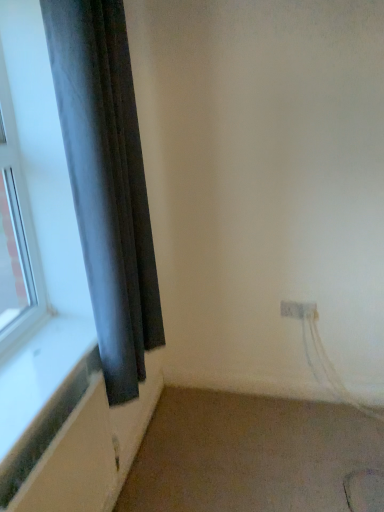
Describe the element at coordinates (107, 183) in the screenshot. This screenshot has height=512, width=384. I see `dark gray fabric curtain at left` at that location.

Identify the location of white plastic electric outlet at lower right. 299,310.

Could you tell me if beige carpet at lower right is facing white plastic electric outlet at lower right?

No, beige carpet at lower right is not turned towards white plastic electric outlet at lower right.

Is beige carpet at lower right taller than white plastic electric outlet at lower right?

In fact, beige carpet at lower right may be shorter than white plastic electric outlet at lower right.

Can you tell me how much beige carpet at lower right and white plastic electric outlet at lower right differ in facing direction?

90.7 degrees separate the facing orientations of beige carpet at lower right and white plastic electric outlet at lower right.

From a real-world perspective, between beige carpet at lower right and white plastic electric outlet at lower right, who is vertically higher?

white plastic electric outlet at lower right, from a real-world perspective.

In the image, is dark gray fabric curtain at left on the left side or the right side of beige carpet at lower right?

Clearly, dark gray fabric curtain at left is on the left of beige carpet at lower right in the image.

From a real-world perspective, is dark gray fabric curtain at left under beige carpet at lower right?

No, from a real-world perspective, dark gray fabric curtain at left is not beneath beige carpet at lower right.

Considering the positions of points (128, 374) and (183, 453), is point (128, 374) farther from camera compared to point (183, 453)?

No, it is not.

From the image's perspective, would you say dark gray fabric curtain at left is positioned over beige carpet at lower right?

Correct, dark gray fabric curtain at left appears higher than beige carpet at lower right in the image.

Is white plastic electric outlet at lower right aimed at beige carpet at lower right?

No, white plastic electric outlet at lower right is not facing towards beige carpet at lower right.

Considering the relative positions of white plastic electric outlet at lower right and beige carpet at lower right in the image provided, is white plastic electric outlet at lower right behind beige carpet at lower right?

Yes.

Is white plastic electric outlet at lower right not close to beige carpet at lower right?

Actually, white plastic electric outlet at lower right and beige carpet at lower right are a little close together.

Can you confirm if white plastic electric outlet at lower right is positioned to the right of beige carpet at lower right?

Correct, you'll find white plastic electric outlet at lower right to the right of beige carpet at lower right.

This screenshot has width=384, height=512. Find the location of `curtain to the left of white plastic electric outlet at lower right`. curtain to the left of white plastic electric outlet at lower right is located at coordinates (107, 183).

From the image's perspective, who appears lower, white plastic electric outlet at lower right or dark gray fabric curtain at left?

white plastic electric outlet at lower right, from the image's perspective.

How many degrees apart are the facing directions of white plastic electric outlet at lower right and dark gray fabric curtain at left?

There is a 90-degree angle between the facing directions of white plastic electric outlet at lower right and dark gray fabric curtain at left.

Which object is positioned more to the right, white plastic electric outlet at lower right or dark gray fabric curtain at left?

white plastic electric outlet at lower right is more to the right.

Could you tell me if dark gray fabric curtain at left is turned towards white plastic electric outlet at lower right?

No, dark gray fabric curtain at left is not oriented towards white plastic electric outlet at lower right.

Is dark gray fabric curtain at left in contact with white plastic electric outlet at lower right?

dark gray fabric curtain at left and white plastic electric outlet at lower right are clearly separated.

Which is more distant, (107, 286) or (304, 317)?

The point (304, 317) is more distant.

Is point (239, 445) closer or farther from the camera than point (129, 73)?

Clearly, point (239, 445) is more distant from the camera than point (129, 73).

Does beige carpet at lower right have a smaller size compared to dark gray fabric curtain at left?

Yes.

Is beige carpet at lower right inside or outside of dark gray fabric curtain at left?

The correct answer is: outside.

From a real-world perspective, is beige carpet at lower right located beneath dark gray fabric curtain at left?

Yes, from a real-world perspective, beige carpet at lower right is below dark gray fabric curtain at left.

The image size is (384, 512). What are the coordinates of `electric outlet on the right of beige carpet at lower right` in the screenshot? It's located at [x=299, y=310].

Locate an element on the screen. plain below the dark gray fabric curtain at left (from a real-world perspective) is located at coordinates coord(248,454).

From the picture: Estimate the real-world distances between objects in this image. Which object is closer to dark gray fabric curtain at left, white plastic electric outlet at lower right or beige carpet at lower right?

beige carpet at lower right is positioned closer to the anchor dark gray fabric curtain at left.

From the picture: When comparing their distances from white plastic electric outlet at lower right, does dark gray fabric curtain at left or beige carpet at lower right seem further?

Among the two, dark gray fabric curtain at left is located further to white plastic electric outlet at lower right.

From the image, which object appears to be farther from beige carpet at lower right, dark gray fabric curtain at left or white plastic electric outlet at lower right?

dark gray fabric curtain at left lies further to beige carpet at lower right than the other object.

Which object lies further to the anchor point white plastic electric outlet at lower right, beige carpet at lower right or dark gray fabric curtain at left?

Based on the image, dark gray fabric curtain at left appears to be further to white plastic electric outlet at lower right.

Considering their positions, is beige carpet at lower right positioned further to dark gray fabric curtain at left than white plastic electric outlet at lower right?

Based on the image, white plastic electric outlet at lower right appears to be further to dark gray fabric curtain at left.

Looking at the image, which one is located further to beige carpet at lower right, white plastic electric outlet at lower right or dark gray fabric curtain at left?

dark gray fabric curtain at left is further to beige carpet at lower right.

Where is `plain between dark gray fabric curtain at left and white plastic electric outlet at lower right along the z-axis`? The height and width of the screenshot is (512, 384). plain between dark gray fabric curtain at left and white plastic electric outlet at lower right along the z-axis is located at coordinates (248, 454).